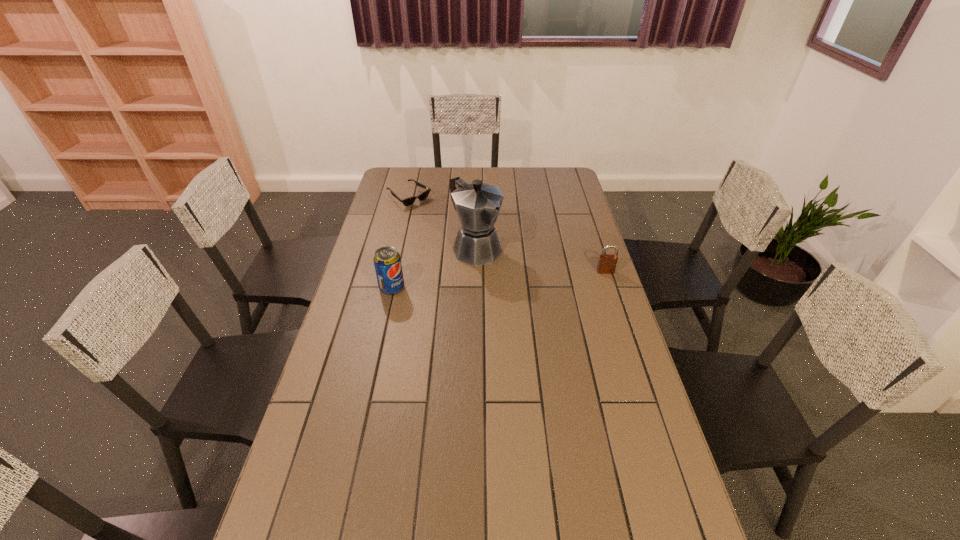
You are a GUI agent. You are given a task and a screenshot of the screen. Output one action in this format:
    pyautogui.click(x=<x>, y=<y>)
    Task: Click on the vacant region between the third farthest object and the coffeepot
    This screenshot has width=960, height=540.
    Given the screenshot: What is the action you would take?
    pyautogui.click(x=541, y=260)

Locate an element on the screen. The width and height of the screenshot is (960, 540). unoccupied position between the coffeepot and the rightmost object is located at coordinates (541, 260).

This screenshot has height=540, width=960. I want to click on free space between the third object from left to right and the nearest object, so click(x=434, y=268).

The height and width of the screenshot is (540, 960). Find the location of `vacant area that lies between the farthest object and the nearest object`. vacant area that lies between the farthest object and the nearest object is located at coordinates (400, 242).

The image size is (960, 540). Identify the location of free area in between the second tallest object and the sunglasses. (400, 242).

The image size is (960, 540). Identify the location of vacant area that lies between the padlock and the second tallest object. (498, 280).

This screenshot has height=540, width=960. In order to click on object that ranks as the closest to the tallest object in this screenshot , I will do tap(387, 261).

Where is `object identified as the second closest to the third nearest object`? object identified as the second closest to the third nearest object is located at coordinates click(x=408, y=201).

Find the location of `free space in the image that satisfies the following two spatial constraints: 1. on the front side of the sunglasses; 2. on the left side of the soda`. free space in the image that satisfies the following two spatial constraints: 1. on the front side of the sunglasses; 2. on the left side of the soda is located at coordinates (388, 288).

This screenshot has height=540, width=960. In order to click on vacant region that satisfies the following two spatial constraints: 1. on the back side of the third nearest object; 2. on the right side of the soda in this screenshot , I will do `click(400, 248)`.